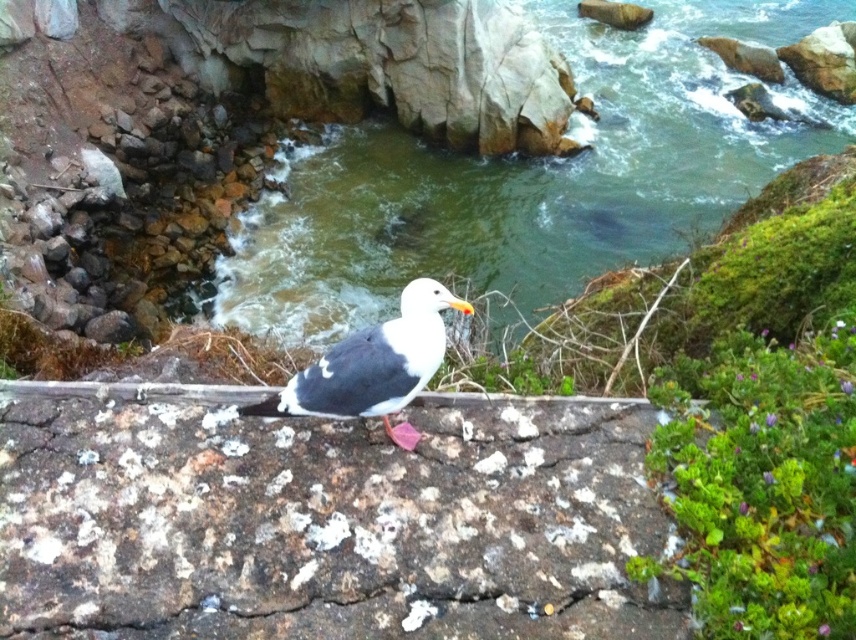
You are a photographer trying to capture the white matte bird at center and the speckled rock at center in your shot. If you want to focus on the bird first, which object should you adjust your camera to focus on first, considering their positions?

The speckled rock at center is closer to the viewer than the white matte bird at center, so you should focus on the white matte bird at center first since it is farther away and may require adjusting the focus beyond the closer rock.

You are standing at the edge of the cliff overlooking the coastal scene. You see the speckled rock at center and the greenish water at center. Which object is shorter in height?

The speckled rock at center has a lesser height compared to the greenish water at center, so the speckled rock at center is shorter in height.